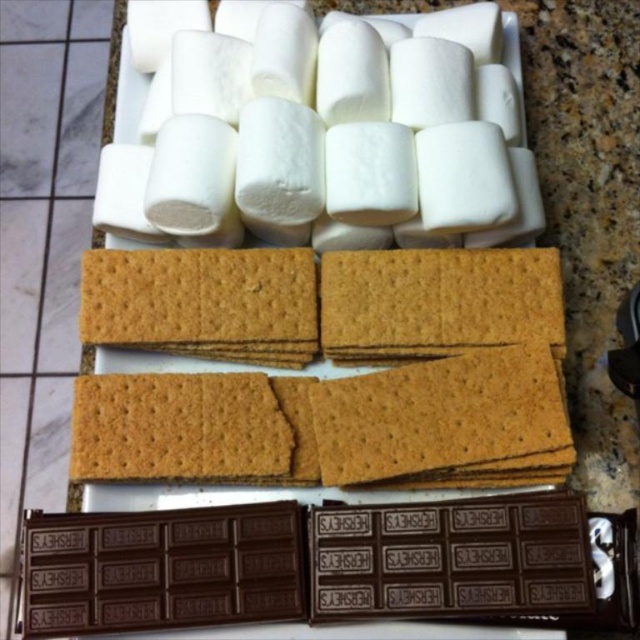
Question: Which point is farther to the camera?

Choices:
 (A) (196, 216)
 (B) (524, 522)

Answer: (A)

Question: Can you confirm if white fluffy marshmallows at upper center is bigger than dark chocolate bar at bottom?

Choices:
 (A) yes
 (B) no

Answer: (A)

Question: Among these points, which one is farthest from the camera?

Choices:
 (A) (419, 611)
 (B) (234, 16)

Answer: (B)

Question: Does white fluffy marshmallows at upper center have a larger size compared to dark chocolate bar at bottom?

Choices:
 (A) yes
 (B) no

Answer: (A)

Question: Which object is farther from the camera taking this photo?

Choices:
 (A) white fluffy marshmallows at upper center
 (B) dark chocolate bar at bottom

Answer: (A)

Question: Does white fluffy marshmallows at upper center have a larger size compared to dark chocolate bar at bottom?

Choices:
 (A) yes
 (B) no

Answer: (A)